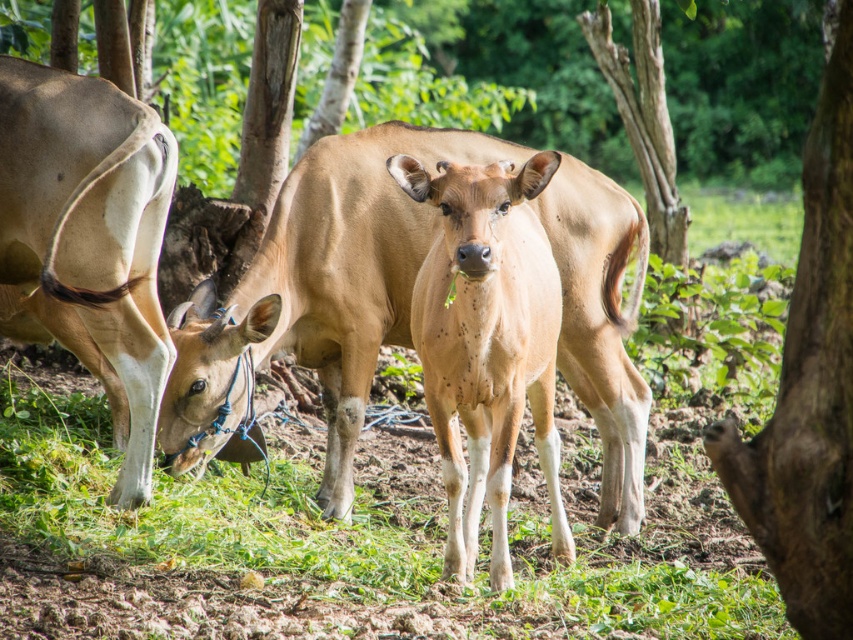
You are standing at the point marked by the coordinates point [355,528]. Looking around, you see the three cows grazing in the field. Which direction should you move to find the green grass at center?

The point [355,528] corresponds to the green grass at center, so you are already standing on the green grass at center.

You are a cow in the field and want to reach the brown rough bark tree at right. Which direction should you move from the green grass at center?

The brown rough bark tree at right is behind the green grass at center, so you should move towards the right side of the field to reach it.